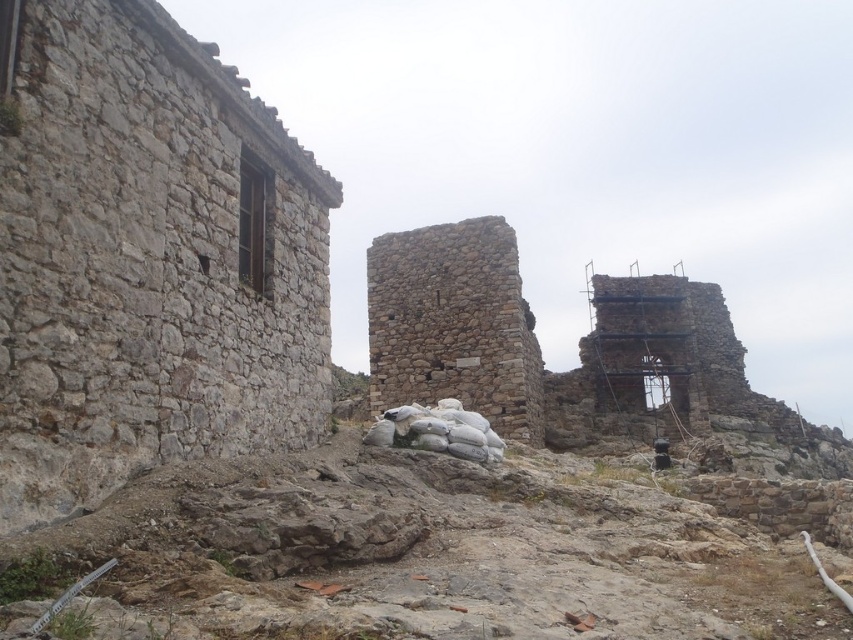
Question: Is rough stone wall at left in front of rustic stone ruins at center?

Choices:
 (A) no
 (B) yes

Answer: (B)

Question: Does rough stone wall at left come behind rustic stone ruins at center?

Choices:
 (A) no
 (B) yes

Answer: (A)

Question: Which object is closer to the camera taking this photo?

Choices:
 (A) rustic stone ruins at center
 (B) rough stone wall at left

Answer: (B)

Question: Is rough stone wall at left further to the viewer compared to rustic stone ruins at center?

Choices:
 (A) no
 (B) yes

Answer: (A)

Question: Which object is farther from the camera taking this photo?

Choices:
 (A) rough stone wall at left
 (B) rustic stone ruins at center

Answer: (B)